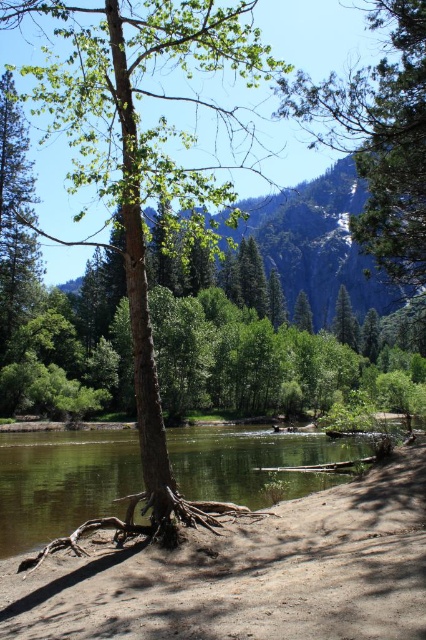
You are standing at the point marked as point (143, 147) in the image. What object is located exactly at that point?

The point (143, 147) corresponds to the brown rough bark tree at center.

You are standing at the center of the riverbank and want to reach both the green textured pine tree at upper right and the green rough bark tree at upper left. Which direction should you walk to reach each tree first?

To reach the green rough bark tree at upper left first, walk towards the left. To reach the green textured pine tree at upper right first, walk towards the right.